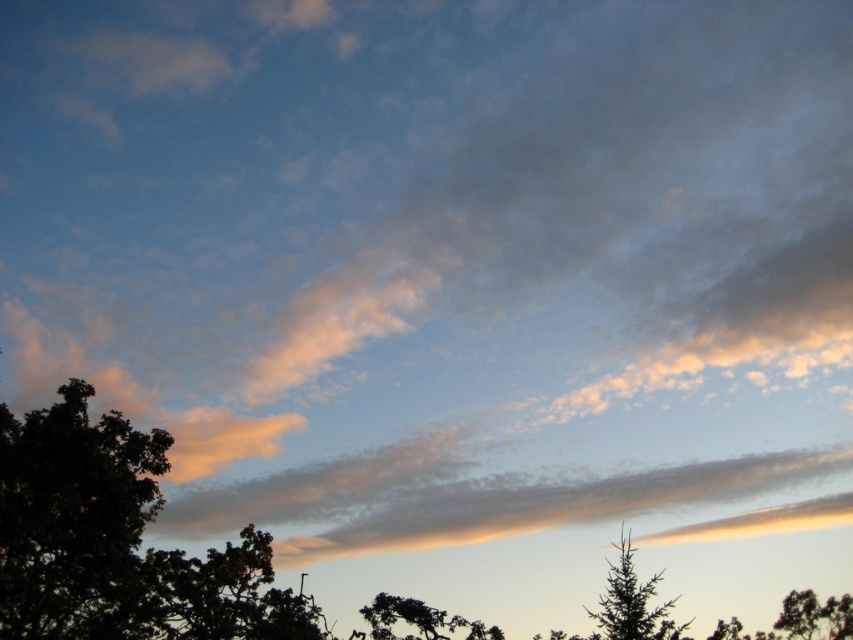
Consider the image. You are standing in a field looking at the sky. You see a point marked at coordinates (631, 602). What object is located at that point?

The point at coordinates (631, 602) indicates the location of the green matte tree at lower right.

You are an artist trying to paint the scene. You want to ensure the dark green leafy tree at lower left and the silhouette textured tree at lower center are proportionally accurate. Which tree should you paint to be taller?

The silhouette textured tree at lower center should be painted taller because the dark green leafy tree at lower left is smaller than it.